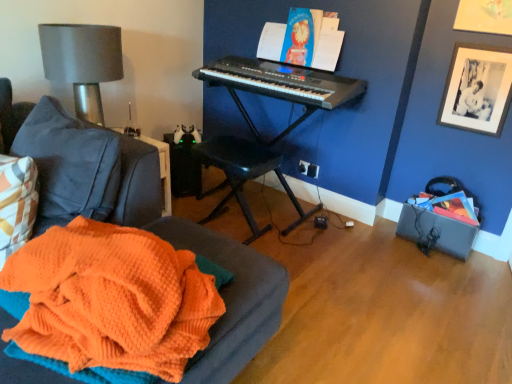
Question: Can you confirm if black plastic keyboard at center is smaller than orange knitted blanket at lower left?

Choices:
 (A) yes
 (B) no

Answer: (B)

Question: From the image's perspective, is black plastic keyboard at center under orange knitted blanket at lower left?

Choices:
 (A) yes
 (B) no

Answer: (B)

Question: Is black plastic keyboard at center wider than orange knitted blanket at lower left?

Choices:
 (A) no
 (B) yes

Answer: (A)

Question: Can orange knitted blanket at lower left be found inside black plastic keyboard at center?

Choices:
 (A) yes
 (B) no

Answer: (B)

Question: Is black plastic keyboard at center shorter than orange knitted blanket at lower left?

Choices:
 (A) no
 (B) yes

Answer: (A)

Question: In terms of height, does black plastic keyboard at upper center look taller or shorter compared to matte blue book at upper center?

Choices:
 (A) tall
 (B) short

Answer: (B)

Question: Considering the positions of black plastic keyboard at upper center and matte blue book at upper center in the image, is black plastic keyboard at upper center wider or thinner than matte blue book at upper center?

Choices:
 (A) thin
 (B) wide

Answer: (B)

Question: Is point (302, 84) positioned closer to the camera than point (286, 39)?

Choices:
 (A) farther
 (B) closer

Answer: (B)

Question: In the image, is black plastic keyboard at upper center positioned in front of or behind matte blue book at upper center?

Choices:
 (A) front
 (B) behind

Answer: (A)

Question: Does point (343, 94) appear closer or farther from the camera than point (236, 152)?

Choices:
 (A) farther
 (B) closer

Answer: (B)

Question: Considering the positions of black plastic keyboard at center and black plastic music stool at center in the image, is black plastic keyboard at center wider or thinner than black plastic music stool at center?

Choices:
 (A) wide
 (B) thin

Answer: (A)

Question: From the image's perspective, is black plastic keyboard at center positioned above or below black plastic music stool at center?

Choices:
 (A) above
 (B) below

Answer: (A)

Question: Considering the positions of black plastic keyboard at center and black plastic music stool at center in the image, is black plastic keyboard at center bigger or smaller than black plastic music stool at center?

Choices:
 (A) big
 (B) small

Answer: (A)

Question: Choose the correct answer: Is orange knitted blanket at lower left inside black plastic keyboard at center or outside it?

Choices:
 (A) inside
 (B) outside

Answer: (B)

Question: Relative to black plastic keyboard at center, is orange knitted blanket at lower left in front or behind?

Choices:
 (A) front
 (B) behind

Answer: (A)